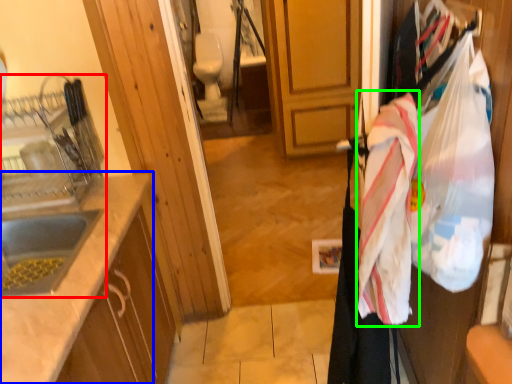
Question: Which object is the closest to the sink (highlighted by a red box)? Choose among these: countertop (highlighted by a blue box) or blanket (highlighted by a green box).

Choices:
 (A) countertop
 (B) blanket

Answer: (A)